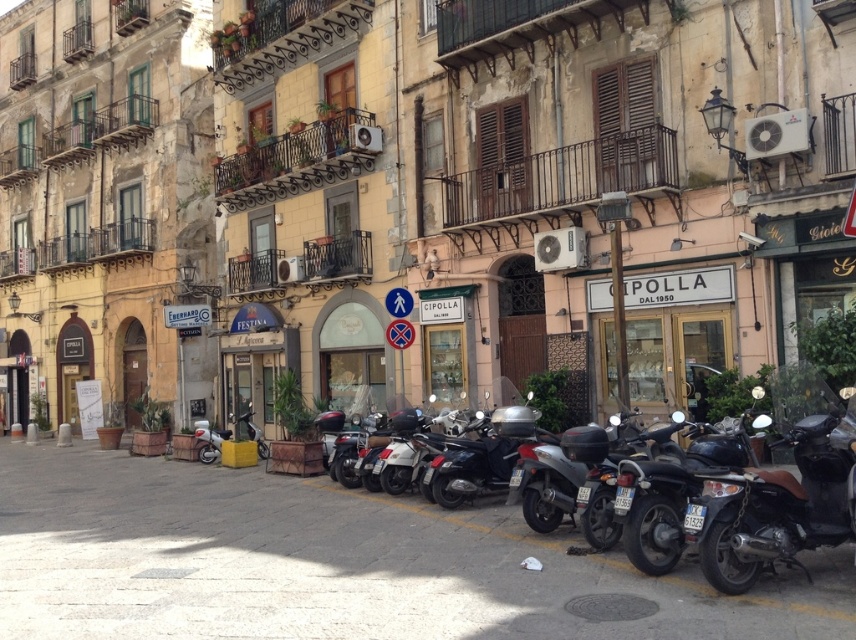
Question: Observing the image, what is the correct spatial positioning of silver metallic scooter at center in reference to white glossy scooter at center?

Choices:
 (A) left
 (B) right

Answer: (B)

Question: Estimate the real-world distances between objects in this image. Which object is closer to the shiny black scooter at center?

Choices:
 (A) white glossy scooter at center
 (B) shiny black scooter at lower right
 (C) shiny black motorcycle at center right
 (D) silver metallic scooter at center

Answer: (D)

Question: Estimate the real-world distances between objects in this image. Which object is closer to the shiny black scooter at center?

Choices:
 (A) shiny black motorcycle at center right
 (B) shiny black scooter at lower right

Answer: (A)

Question: Can you confirm if shiny black scooter at lower right is smaller than shiny black scooter at center?

Choices:
 (A) no
 (B) yes

Answer: (B)

Question: Among these points, which one is farthest from the camera?

Choices:
 (A) 446,468
 (B) 197,438
 (C) 556,525
 (D) 824,449

Answer: (B)

Question: Does shiny black motorcycle at center right come in front of white glossy scooter at center?

Choices:
 (A) yes
 (B) no

Answer: (A)